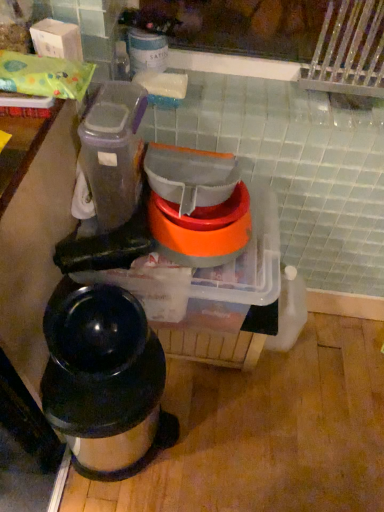
Question: From the image's perspective, is translucent plastic containers at center, the 1th appliance positioned from the bottom, below translucent plastic container at upper left, which is the 3th appliance in bottom-to-top order?

Choices:
 (A) no
 (B) yes

Answer: (B)

Question: Is translucent plastic containers at center, the 1th appliance positioned from the bottom, further to the viewer compared to translucent plastic container at upper left, acting as the 1th appliance starting from the top?

Choices:
 (A) yes
 (B) no

Answer: (A)

Question: Considering the relative sizes of translucent plastic containers at center, which appears as the 3th appliance when viewed from the top, and translucent plastic container at upper left, which is the 3th appliance in bottom-to-top order, in the image provided, is translucent plastic containers at center, which appears as the 3th appliance when viewed from the top, bigger than translucent plastic container at upper left, which is the 3th appliance in bottom-to-top order,?

Choices:
 (A) no
 (B) yes

Answer: (B)

Question: Does translucent plastic containers at center, the 1th appliance positioned from the bottom, have a lesser width compared to translucent plastic container at upper left, which is the 3th appliance in bottom-to-top order?

Choices:
 (A) no
 (B) yes

Answer: (A)

Question: From a real-world perspective, is translucent plastic containers at center, which appears as the 3th appliance when viewed from the top, physically above translucent plastic container at upper left, acting as the 1th appliance starting from the top?

Choices:
 (A) yes
 (B) no

Answer: (B)

Question: Considering their positions, is translucent plastic container at upper left, which is the 3th appliance in bottom-to-top order, located in front of or behind translucent plastic containers at center, the 1th appliance positioned from the bottom?

Choices:
 (A) behind
 (B) front

Answer: (B)

Question: Is translucent plastic container at upper left, which is the 3th appliance in bottom-to-top order, to the left or to the right of translucent plastic containers at center, the 1th appliance positioned from the bottom, in the image?

Choices:
 (A) left
 (B) right

Answer: (A)

Question: In terms of size, does translucent plastic container at upper left, which is the 3th appliance in bottom-to-top order, appear bigger or smaller than translucent plastic containers at center, the 1th appliance positioned from the bottom?

Choices:
 (A) small
 (B) big

Answer: (A)

Question: From a real-world perspective, relative to translucent plastic containers at center, the 1th appliance positioned from the bottom, is translucent plastic container at upper left, which is the 3th appliance in bottom-to-top order, vertically above or below?

Choices:
 (A) above
 (B) below

Answer: (A)

Question: Is point (215, 216) positioned closer to the camera than point (167, 437)?

Choices:
 (A) farther
 (B) closer

Answer: (B)

Question: From the image's perspective, is orange translucent bowls at center, which appears as the 2th appliance when ordered from the bottom, located above or below shiny black thermos at lower left?

Choices:
 (A) above
 (B) below

Answer: (A)

Question: Relative to shiny black thermos at lower left, is orange translucent bowls at center, which appears as the 2th appliance when ordered from the bottom, in front or behind?

Choices:
 (A) front
 (B) behind

Answer: (B)

Question: Is orange translucent bowls at center, which is counted as the 2th appliance, starting from the top, situated inside shiny black thermos at lower left or outside?

Choices:
 (A) inside
 (B) outside

Answer: (B)

Question: Is orange translucent bowls at center, which appears as the 2th appliance when ordered from the bottom, taller or shorter than translucent plastic container at upper left, acting as the 1th appliance starting from the top?

Choices:
 (A) tall
 (B) short

Answer: (B)

Question: In the image, is orange translucent bowls at center, which is counted as the 2th appliance, starting from the top, on the left side or the right side of translucent plastic container at upper left, which is the 3th appliance in bottom-to-top order?

Choices:
 (A) right
 (B) left

Answer: (A)